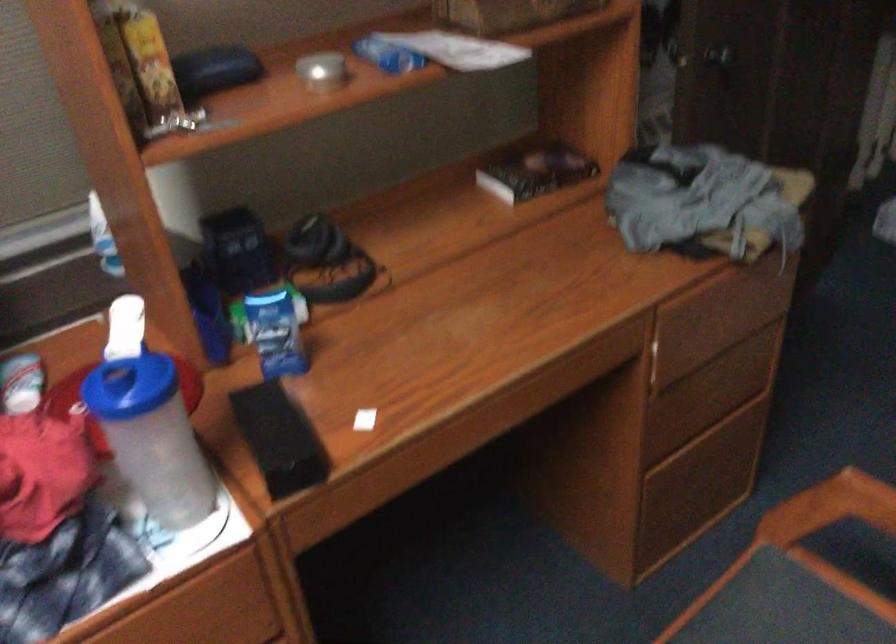
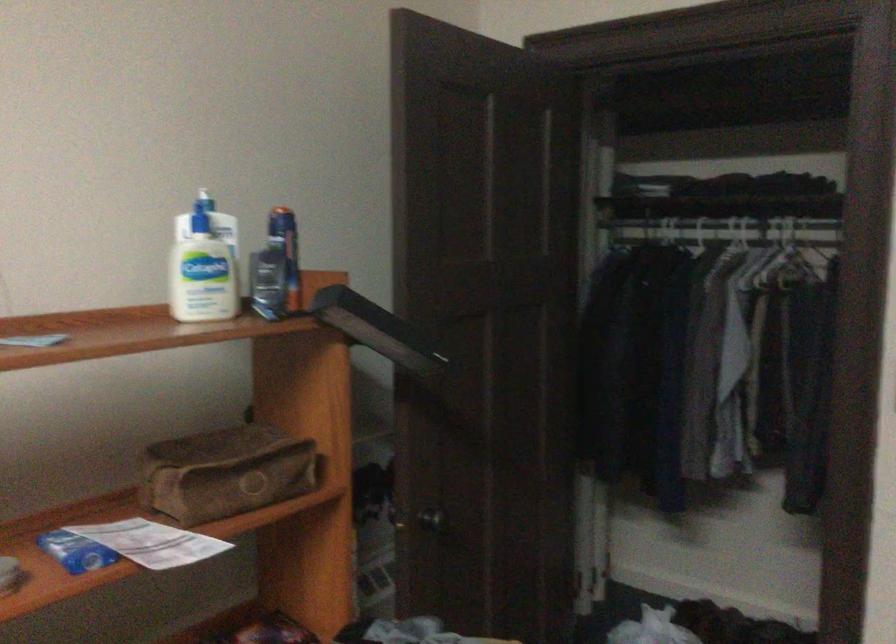
First-person continuous shooting, in which direction is the camera rotating?

The camera rotated toward right-up.